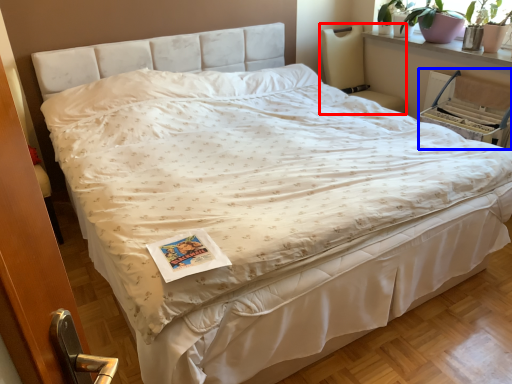
Question: Which of the following is the farthest to the observer, rocking chair (highlighted by a red box) or armchair (highlighted by a blue box)?

Choices:
 (A) rocking chair
 (B) armchair

Answer: (A)